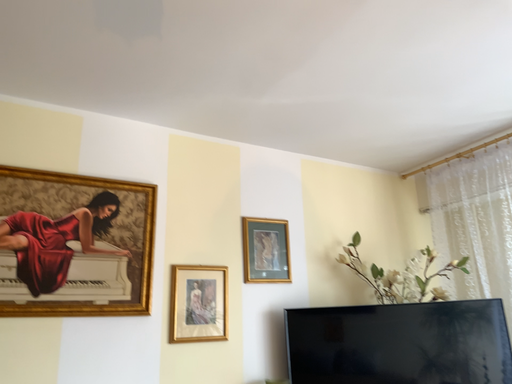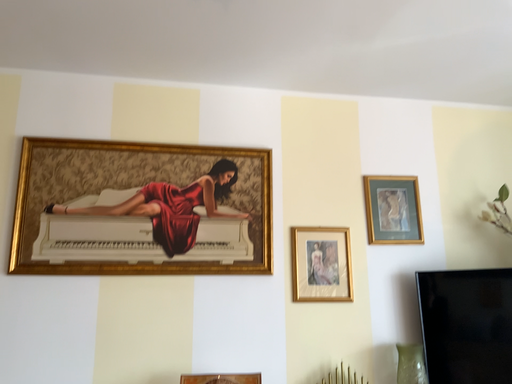
Question: Which way did the camera rotate in the video?

Choices:
 (A) rotated right
 (B) rotated left

Answer: (B)